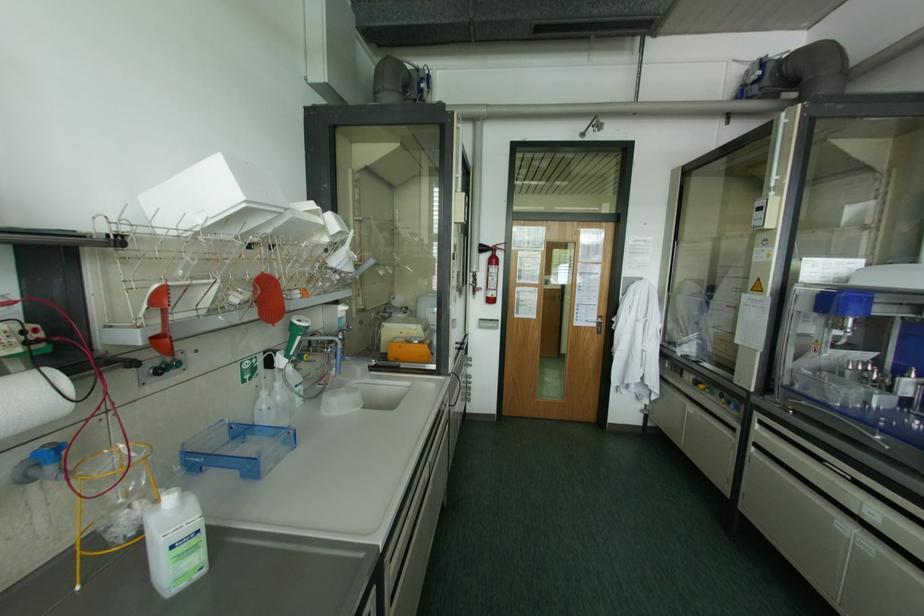
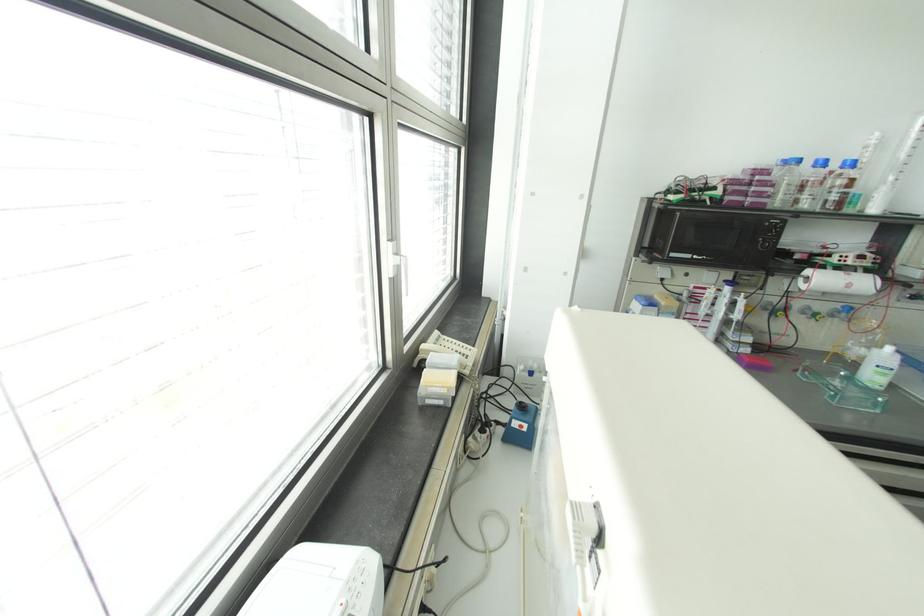
Where in the second image is the point corresponding to pixel 53 451 from the first image?

(848, 309)